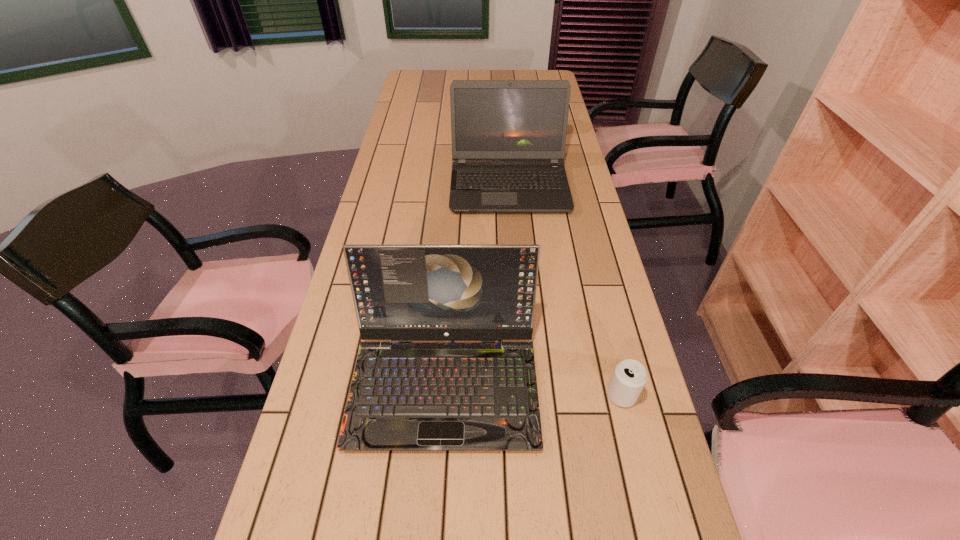
Where is `free point that satisfies the following two spatial constraints: 1. on the screen of the can; 2. on the right side of the farthest object`? This screenshot has height=540, width=960. free point that satisfies the following two spatial constraints: 1. on the screen of the can; 2. on the right side of the farthest object is located at coordinates (526, 395).